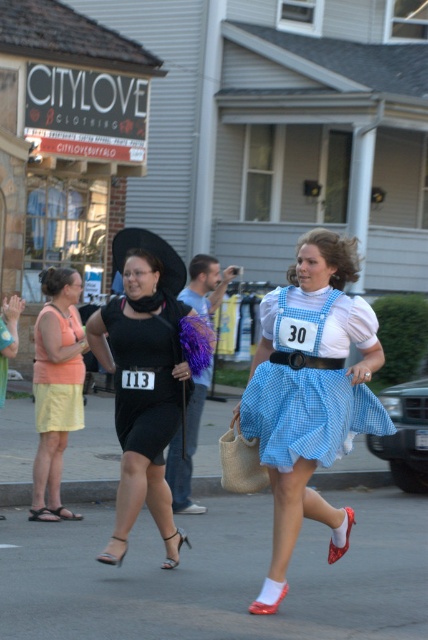
Can you confirm if black matte dress at center is positioned to the left of black satin dress at center?

Correct, you'll find black matte dress at center to the left of black satin dress at center.

Who is more distant from viewer, [149,472] or [119,378]?

The point [119,378] is more distant.

Identify the location of black matte dress at center. (142, 394).

Which is more to the right, blue gingham skirt at center or blue gingham dress at center?

Positioned to the right is blue gingham dress at center.

Is blue gingham skirt at center shorter than blue gingham dress at center?

No.

Locate an element on the screen. Image resolution: width=428 pixels, height=640 pixels. blue gingham skirt at center is located at coordinates (309, 394).

This screenshot has height=640, width=428. Identify the location of blue gingham dress at center. (308, 413).

Image resolution: width=428 pixels, height=640 pixels. What are the coordinates of `blue gingham dress at center` in the screenshot? It's located at (308, 413).

Locate an element on the screen. blue gingham dress at center is located at coordinates (308, 413).